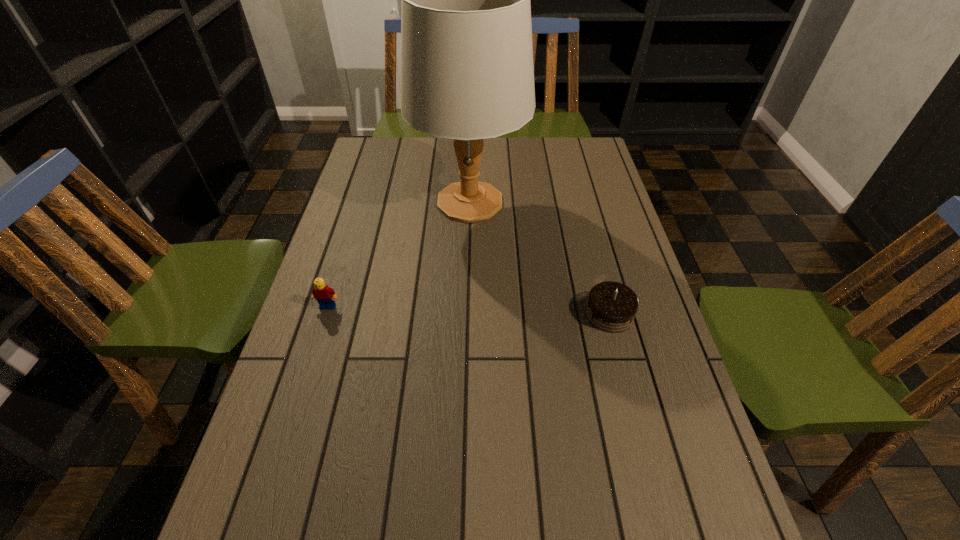
Select which object is the closest to the tallest object. Please provide its 2D coordinates. Your answer should be formatted as a tuple, i.e. [(x, y)], where the tuple contains the x and y coordinates of a point satisfying the conditions above.

[(611, 307)]

This screenshot has width=960, height=540. Find the location of `object that is the second closest to the Lego`. object that is the second closest to the Lego is located at coordinates (611, 307).

Identify the location of free space that satisfies the following two spatial constraints: 1. on the front-facing side of the chocolate cake; 2. on the right side of the leftmost object. (325, 314).

The height and width of the screenshot is (540, 960). Identify the location of free location that satisfies the following two spatial constraints: 1. on the front-facing side of the leftmost object; 2. on the right side of the rightmost object. [325, 314].

Where is `free space that satisfies the following two spatial constraints: 1. on the front side of the table lamp; 2. on the left side of the rightmost object`? free space that satisfies the following two spatial constraints: 1. on the front side of the table lamp; 2. on the left side of the rightmost object is located at coordinates (467, 314).